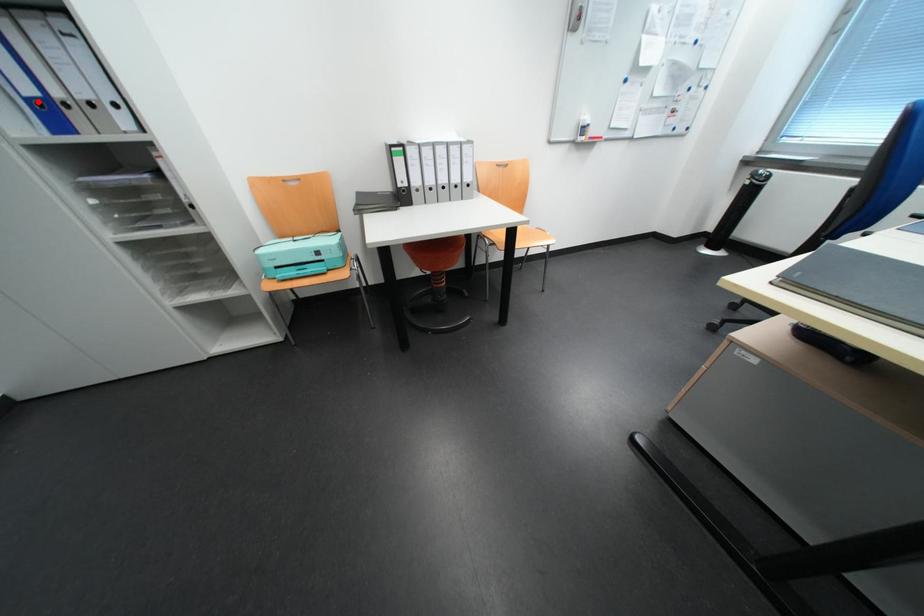
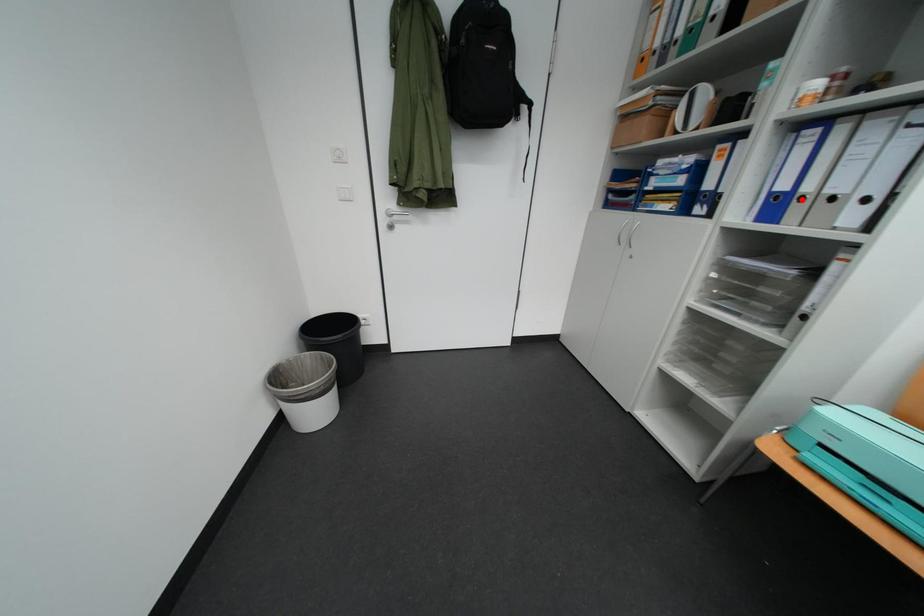
I am providing you with two images of the same scene from different viewpoints. A red point is marked on the first image and another point is marked on the second image. Is the red point in image1 aligned with the point shown in image2?

No